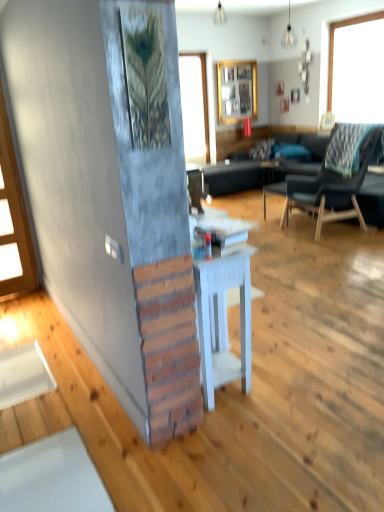
Question: Could matte white lampshade at upper center, which is counted as the 2th lamp, starting from the bottom, be considered to be inside white wood side table at center?

Choices:
 (A) yes
 (B) no

Answer: (B)

Question: From a real-world perspective, is white wood side table at center physically above matte white lampshade at upper center, the first lamp in the top-to-bottom sequence?

Choices:
 (A) yes
 (B) no

Answer: (B)

Question: From the image's perspective, is white wood side table at center over matte white lampshade at upper center, placed as the second lamp when sorted from front to back?

Choices:
 (A) yes
 (B) no

Answer: (B)

Question: Is white wood side table at center far away from matte white lampshade at upper center, placed as the second lamp when sorted from front to back?

Choices:
 (A) no
 (B) yes

Answer: (B)

Question: Is white wood side table at center at the left side of matte white lampshade at upper center, which appears as the 1th lamp when viewed from the back?

Choices:
 (A) no
 (B) yes

Answer: (A)

Question: In terms of height, does matte glass bulb at upper center, the second lamp when ordered from back to front, look taller or shorter compared to wooden frame at upper center?

Choices:
 (A) short
 (B) tall

Answer: (A)

Question: Does point (289, 15) appear closer or farther from the camera than point (221, 77)?

Choices:
 (A) closer
 (B) farther

Answer: (A)

Question: Is matte glass bulb at upper center, the 1th lamp from the right, wider or thinner than wooden frame at upper center?

Choices:
 (A) thin
 (B) wide

Answer: (B)

Question: Relative to wooden frame at upper center, is matte glass bulb at upper center, acting as the 1th lamp starting from the front, in front or behind?

Choices:
 (A) behind
 (B) front

Answer: (B)

Question: Do you think matte white lampshade at upper center, placed as the second lamp when sorted from front to back, is within wooden frame at upper center, or outside of it?

Choices:
 (A) outside
 (B) inside

Answer: (A)

Question: In terms of size, does matte white lampshade at upper center, arranged as the second lamp when viewed from the right, appear bigger or smaller than wooden frame at upper center?

Choices:
 (A) big
 (B) small

Answer: (B)

Question: From a real-world perspective, is matte white lampshade at upper center, which is counted as the 2th lamp, starting from the bottom, above or below wooden frame at upper center?

Choices:
 (A) below
 (B) above

Answer: (B)

Question: Relative to wooden frame at upper center, is matte white lampshade at upper center, which is counted as the 1th lamp, starting from the left, in front or behind?

Choices:
 (A) behind
 (B) front

Answer: (B)

Question: Is wooden picture frame at upper right inside the boundaries of dark gray fabric chair at right, or outside?

Choices:
 (A) inside
 (B) outside

Answer: (B)

Question: Is point (334, 119) closer or farther from the camera than point (294, 193)?

Choices:
 (A) farther
 (B) closer

Answer: (A)